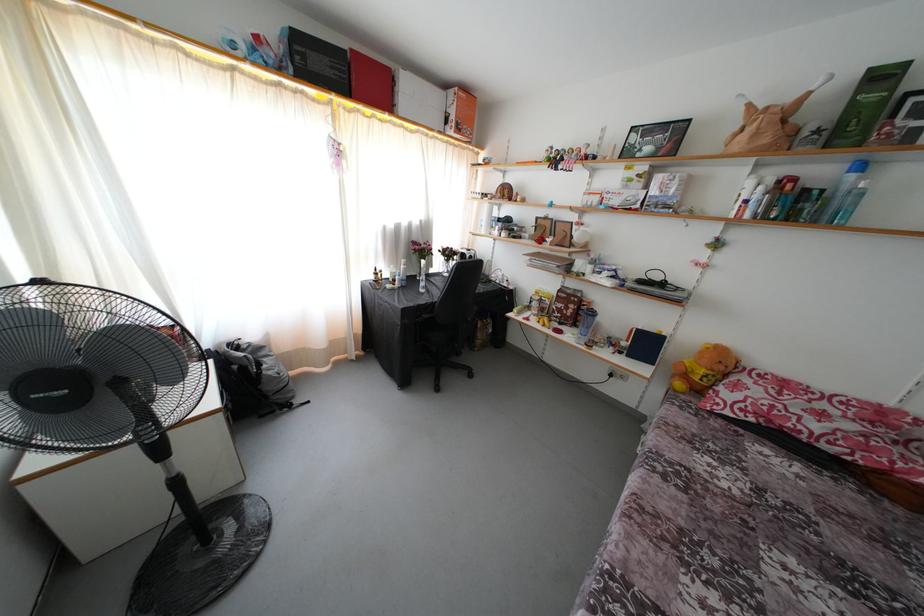
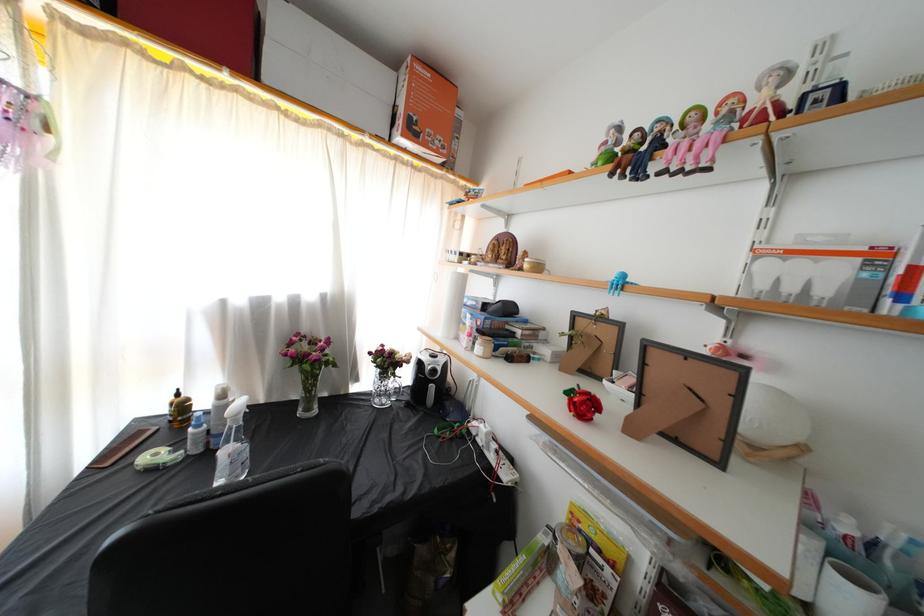
Question: In a continuous first-person perspective shot, in which direction is the camera moving?

Choices:
 (A) Left
 (B) Right
 (C) Forward
 (D) Backward

Answer: (C)